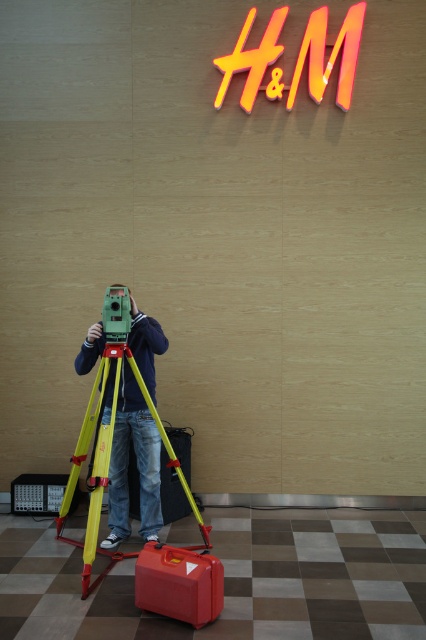
You are a delivery person who needs to place a package on the floor near the red plastic suitcase at center. However, there is an orange neon sign at upper center above it. Will the sign block your view of the suitcase when you look down to place the package?

The orange neon sign at upper center is positioned over the red plastic suitcase at center, so it might block your view of the suitcase when looking down. You should check the position carefully before placing the package.

You are a delivery person who needs to place a new package between the green matte tripod at center and the red plastic suitcase at center. The package is 18 inches long. Can you fit it between them without moving either object?

The distance between the green matte tripod at center and the red plastic suitcase at center is 17.57 inches. Since the package is 18 inches long, it cannot fit between them without moving either object.